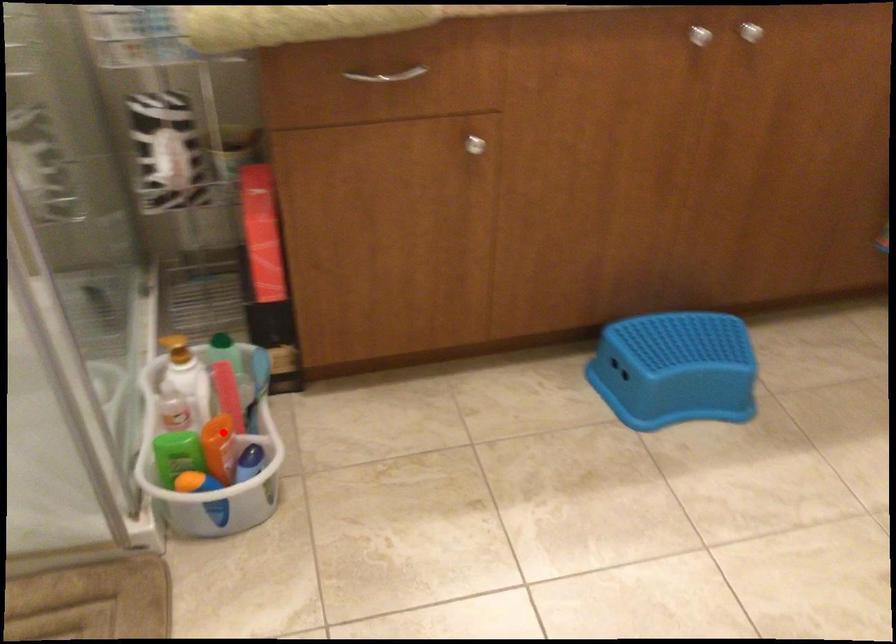
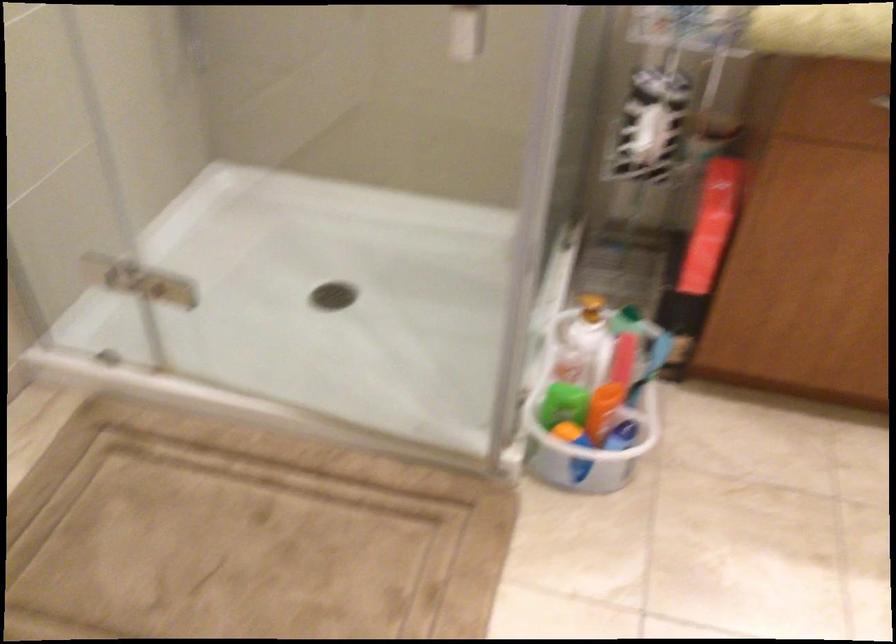
Find the pixel in the second image that matches the highlighted location in the first image.

(610, 393)